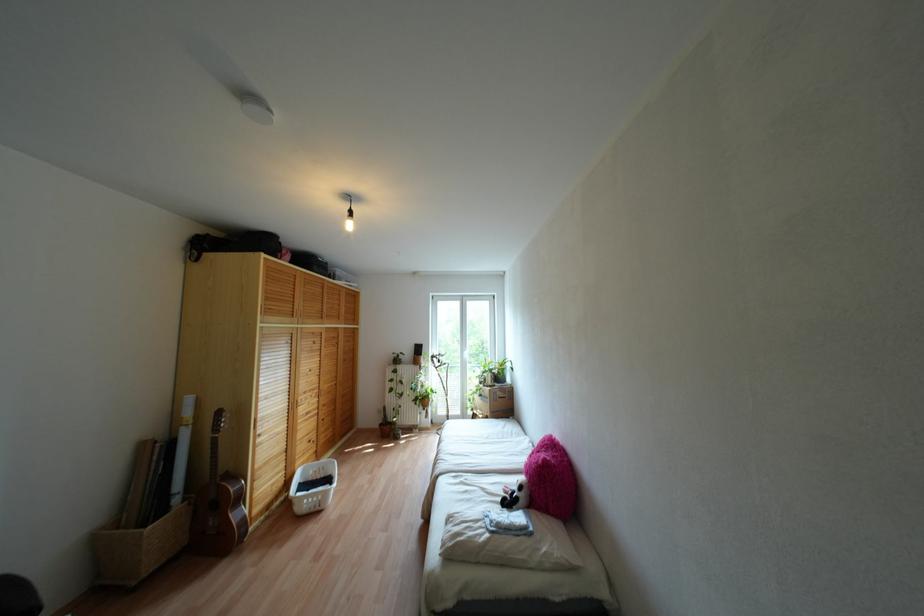
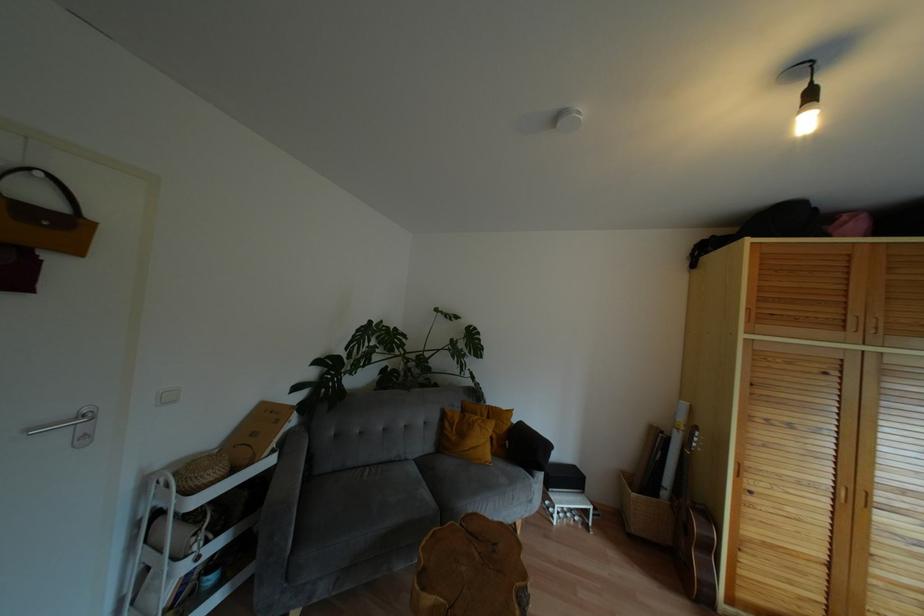
Where in the second image is the point corresponding to point (348, 225) from the first image?

(806, 123)